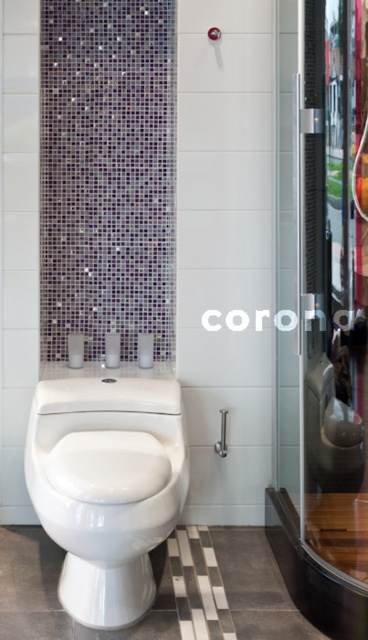
You are a bathroom designer planning to install a new grab bar between the white glossy toilet at lower left and the satin nickel shower handle at upper center. Since the grab bar must be placed horizontally, which object should you position the grab bar closer to to ensure it fits within the available space?

The white glossy toilet at lower left has a larger width than the satin nickel shower handle at upper center. Therefore, positioning the grab bar closer to the satin nickel shower handle at upper center will ensure it fits within the narrower space.

You are a home inspector assessing the bathroom layout. You need to determine the vertical positioning of the transparent glass shower door at right relative to the satin nickel shower handle at upper center. Based on the scene, which object is positioned higher?

The transparent glass shower door at right is located above the satin nickel shower handle at upper center, meaning the shower door is positioned higher than the handle.

You are a contractor planning to install a new faucet in the bathroom. You need to ensure it won not block the view of the shower handle. Based on the scene, where should the faucet be placed relative to the white glossy toilet at lower left and the satin nickel shower handle at upper center?

The white glossy toilet at lower left is to the left of the satin nickel shower handle at upper center, so placing the faucet to the left of the white glossy toilet at lower left would keep it out of the way and avoid blocking the view of the shower handle.